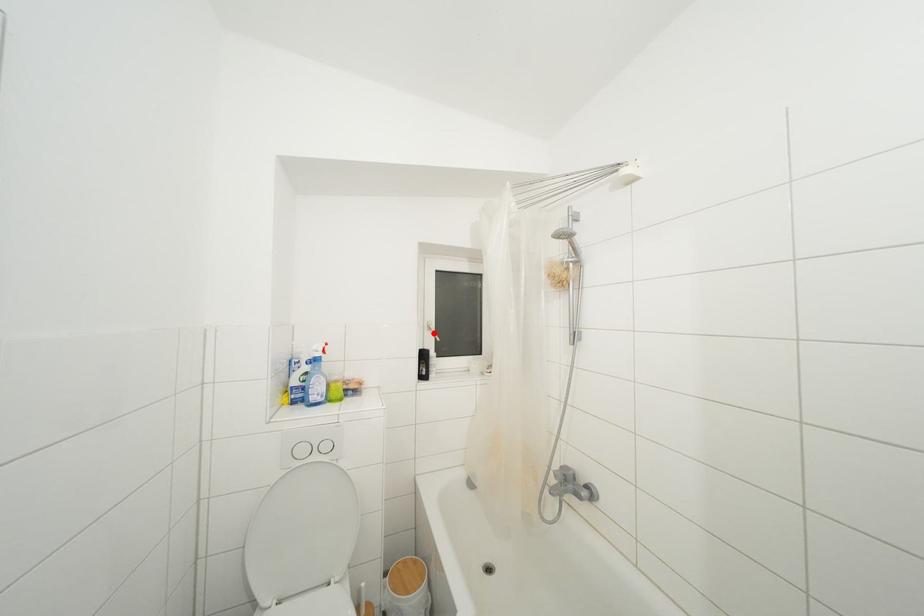
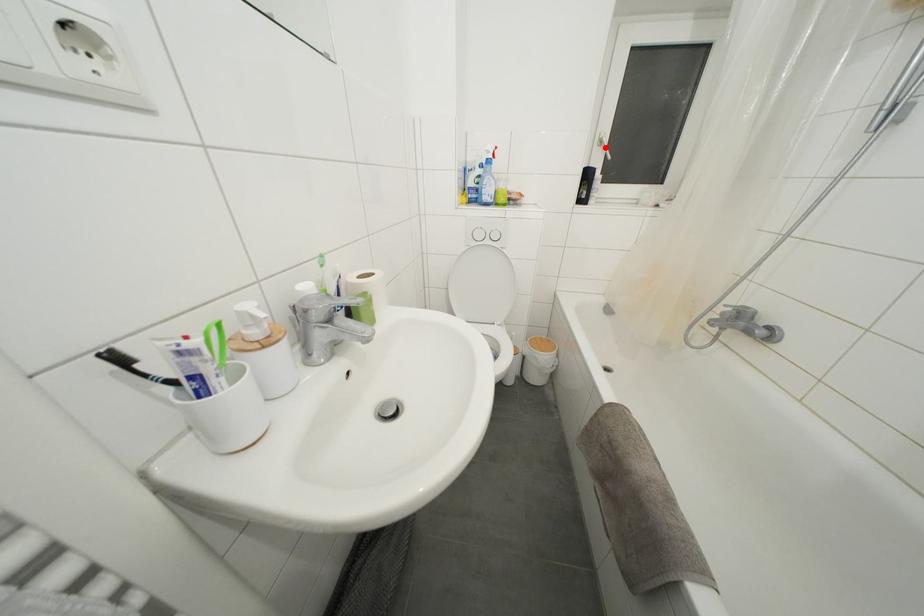
I am providing you with two images of the same scene from different viewpoints. A red point is marked on the first image and another point is marked on the second image. Is the red point in image1 aligned with the point shown in image2?

Yes